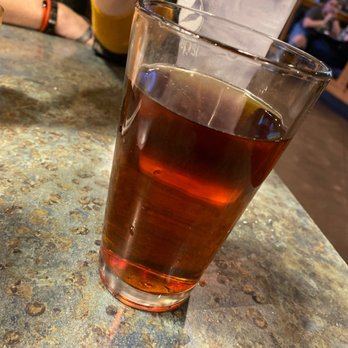
The image size is (348, 348). What are the coordinates of `jar` in the screenshot? It's located at (132, 294).